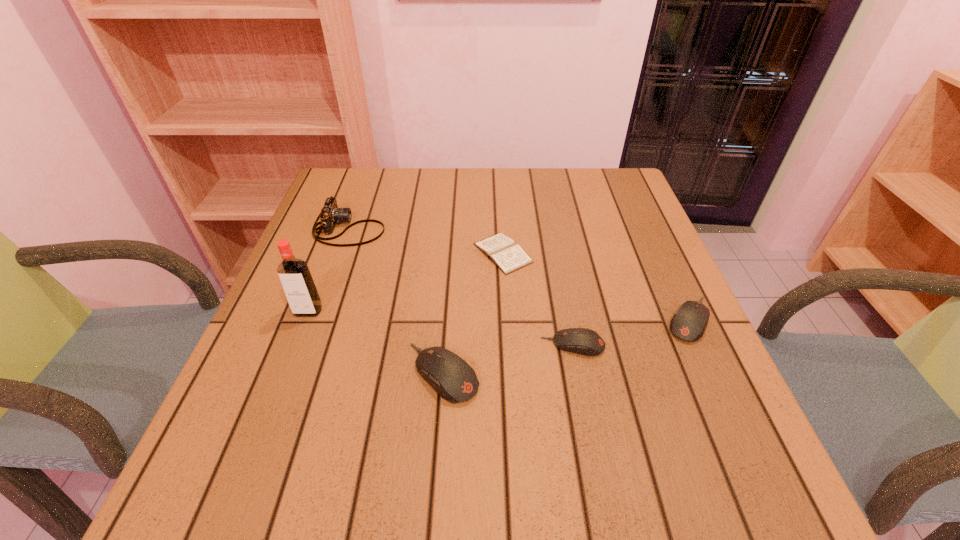
Locate an element on the screen. This screenshot has width=960, height=540. blank area in the image that satisfies the following two spatial constraints: 1. on the back side of the diary; 2. on the right side of the leftmost computer mouse is located at coordinates (451, 253).

The image size is (960, 540). What are the coordinates of `blank area in the image that satisfies the following two spatial constraints: 1. on the front-facing side of the camera; 2. on the left side of the leftmost computer mouse` in the screenshot? It's located at (298, 373).

Locate an element on the screen. free region that satisfies the following two spatial constraints: 1. on the back side of the leftmost computer mouse; 2. on the left side of the diary is located at coordinates 451,253.

The image size is (960, 540). I want to click on vacant space that satisfies the following two spatial constraints: 1. on the back side of the diary; 2. on the left side of the leftmost computer mouse, so (451, 253).

Locate an element on the screen. Image resolution: width=960 pixels, height=540 pixels. free space in the image that satisfies the following two spatial constraints: 1. on the front-facing side of the camera; 2. on the right side of the second computer mouse from right to left is located at coordinates (307, 345).

Find the location of a particular element. The width and height of the screenshot is (960, 540). vacant space that satisfies the following two spatial constraints: 1. on the front-facing side of the camera; 2. on the back side of the shortest object is located at coordinates (341, 253).

Identify the location of vacant area in the image that satisfies the following two spatial constraints: 1. on the front and back of the second computer mouse from left to right; 2. on the left side of the vodka. This screenshot has height=540, width=960. (296, 345).